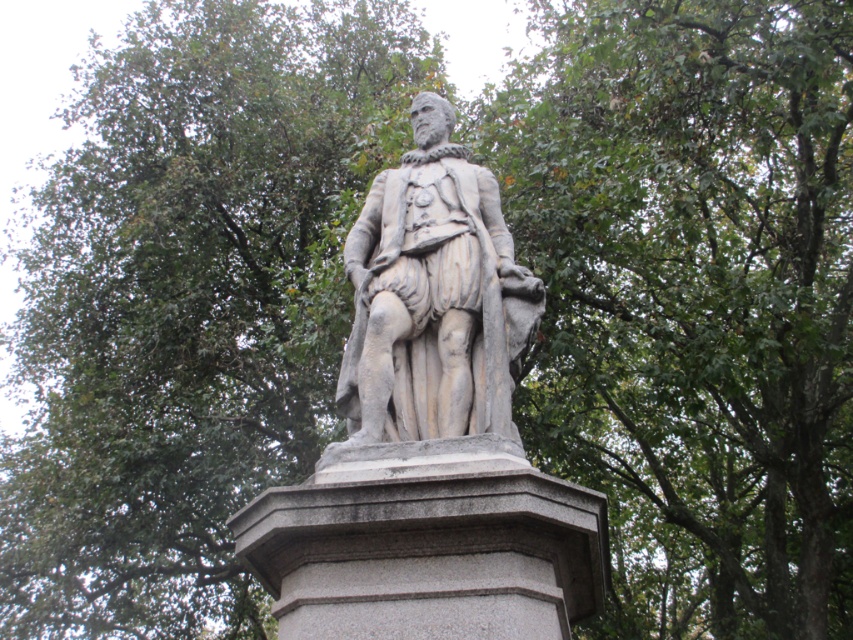
You are an art conservator assessing the stability of the statue. Given that the gray granite pedestal at center is smaller than the stone statue at center, would you recommend reinforcing the base to prevent toppling?

The gray granite pedestal at center is smaller than the stone statue at center, which may compromise stability. Reinforcement of the base is recommended to prevent toppling.

You are an art student standing in front of a statue of a historical figure. The statue is placed on the gray granite pedestal at center. If you want to sketch the statue, would you need to move closer than 15 meters to get a clear view?

The gray granite pedestal at center is 15.01 meters away from the viewer. Since you need to be closer than 15 meters to sketch clearly, you should move forward by at least 0.01 meters to be within the required distance.